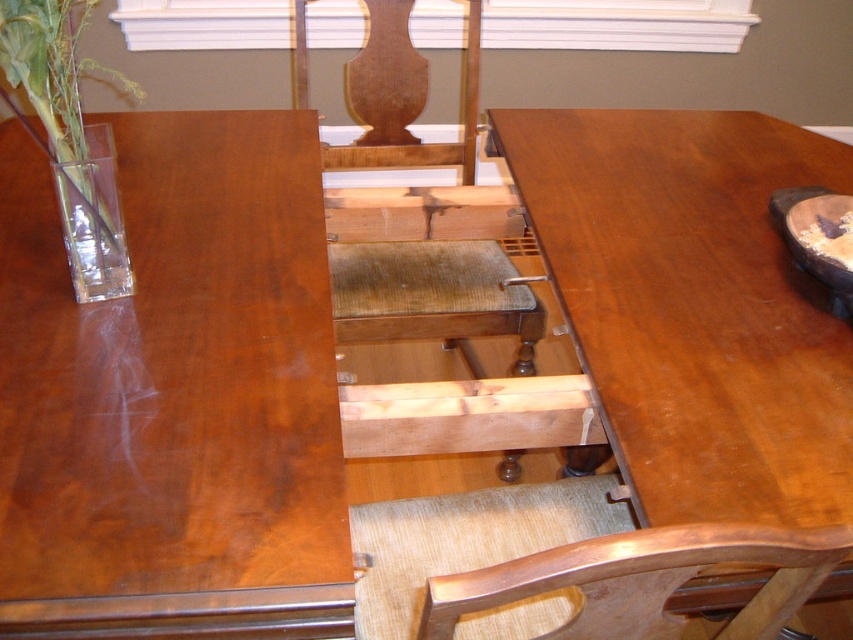
Question: Can you confirm if wooden at center is thinner than wooden textured chair back at center?

Choices:
 (A) yes
 (B) no

Answer: (B)

Question: Which point is closer to the camera taking this photo?

Choices:
 (A) (685, 148)
 (B) (247, 296)
 (C) (447, 292)
 (D) (99, 192)

Answer: (D)

Question: Which point is farther to the camera?

Choices:
 (A) wooden at center
 (B) glossy wood table at left
 (C) glossy wood table at center

Answer: (A)

Question: Which point is closer to the camera?

Choices:
 (A) clear glass vase at left
 (B) wooden at center
 (C) glossy wood table at center
 (D) wooden textured chair back at center

Answer: (D)

Question: Does glossy wood table at center lie in front of clear glass vase at left?

Choices:
 (A) no
 (B) yes

Answer: (B)

Question: Can you confirm if wooden at center is positioned above clear glass vase at left?

Choices:
 (A) no
 (B) yes

Answer: (B)